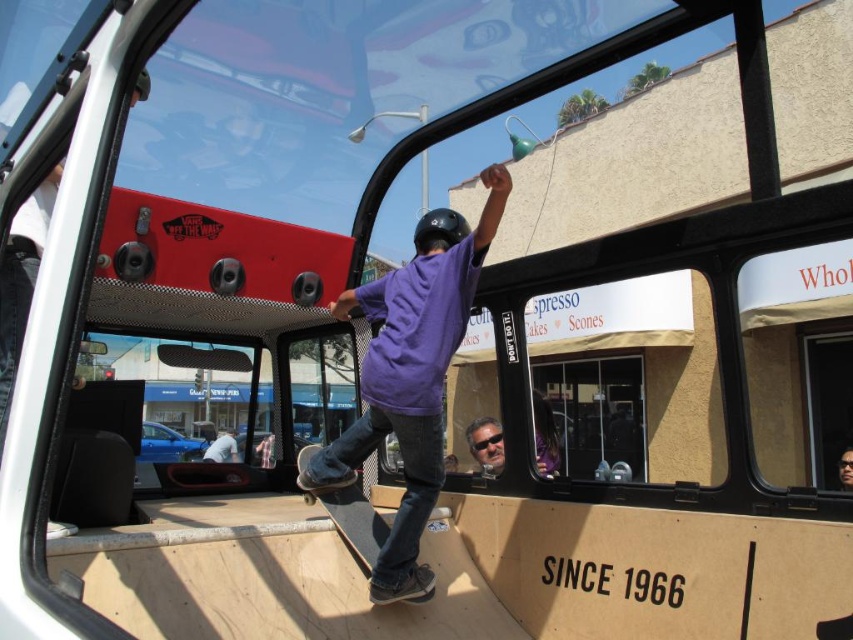
You are a passenger on the bus and want to place your purple matte skateboard at center and wooden skateboard at center on the floor. Since the bus is moving, you need to know which skateboard is on the right to secure it first. Which one is on the right?

The purple matte skateboard at center is positioned on the right side of wooden skateboard at center, so the purple matte skateboard at center is on the right.

You are a passenger on the bus and want to know if the person with gray textured hair at center is sitting or standing. Based on their position relative to the light blue jeans at lower center, can you determine this?

The gray textured hair at center is above the light blue jeans at lower center, which suggests the person is standing since the hair is positioned higher than the jeans.